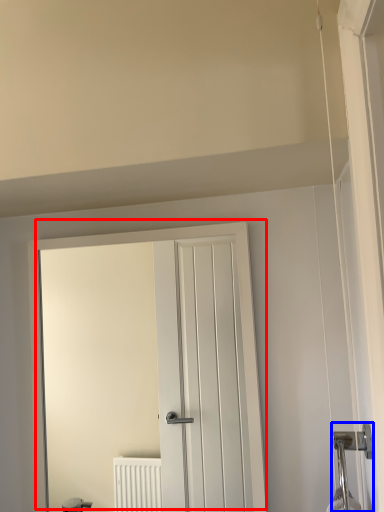
Question: Which of the following is the closest to the observer, door (highlighted by a red box) or door handle (highlighted by a blue box)?

Choices:
 (A) door
 (B) door handle

Answer: (B)